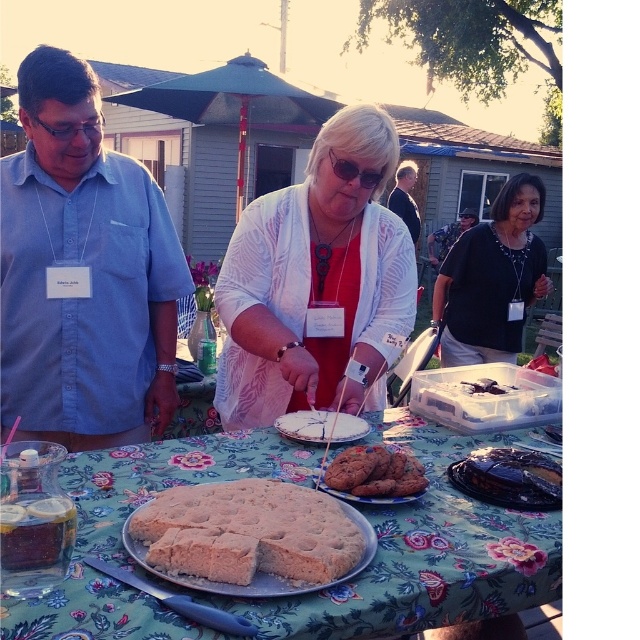
Question: Can you confirm if matte blue shirt at left is positioned to the right of matte black sunglasses at center?

Choices:
 (A) no
 (B) yes

Answer: (A)

Question: Considering the real-world distances, which object is closest to the white matte plate at center?

Choices:
 (A) golden brown cake at center
 (B) matte black shirt at center

Answer: (A)

Question: Is matte blue shirt at left positioned at the back of dark blue shirt at center?

Choices:
 (A) no
 (B) yes

Answer: (A)

Question: Is chocolate chip cookies at center below dark blue shirt at center?

Choices:
 (A) no
 (B) yes

Answer: (B)

Question: Which of the following is the farthest from the observer?

Choices:
 (A) (324, 474)
 (B) (321, 516)
 (C) (461, 449)

Answer: (C)

Question: Which of the following is the closest to the observer?

Choices:
 (A) chocolate chip cookies at center
 (B) matte black sunglasses at center
 (C) matte blue shirt at left

Answer: (A)